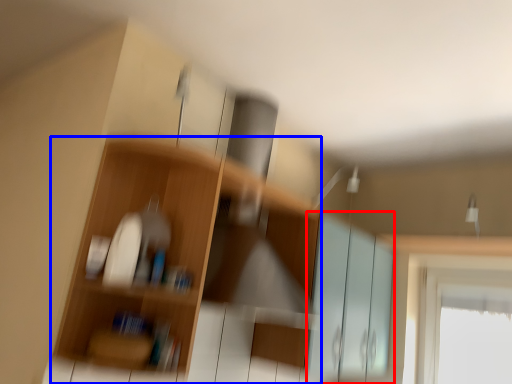
Question: Which object appears farthest to the camera in this image, screen door (highlighted by a red box) or shelf (highlighted by a blue box)?

Choices:
 (A) screen door
 (B) shelf

Answer: (A)